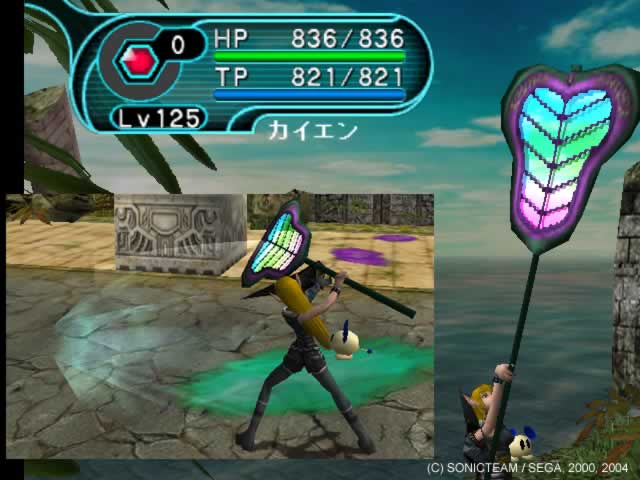
I want to click on paddle handle, so click(522, 318), click(408, 307).